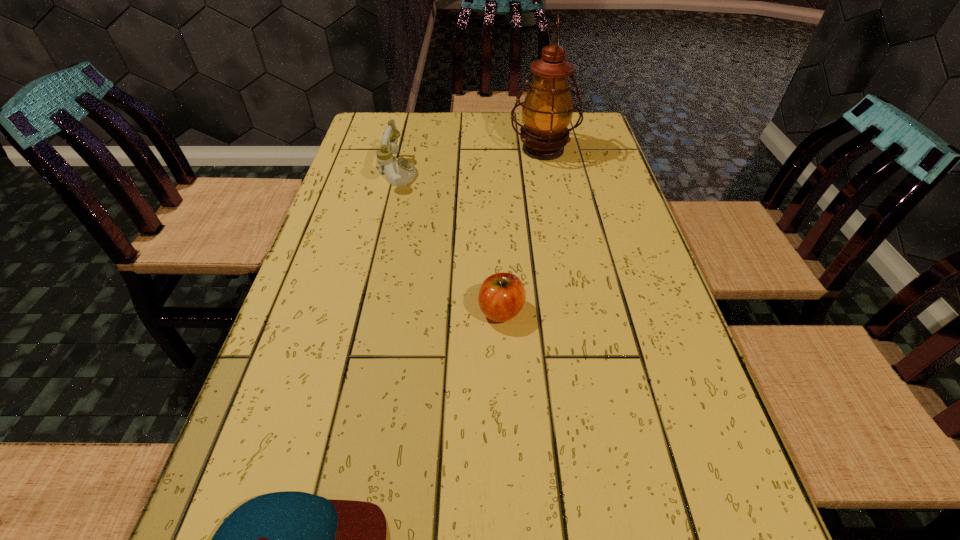
Identify which object is the closest to the baseball cap. Please provide its 2D coordinates. Your answer should be formatted as a tuple, i.e. [(x, y)], where the tuple contains the x and y coordinates of a point satisfying the conditions above.

[(501, 297)]

At what (x,y) coordinates should I click in order to perform the action: click on the second closest object to the telephone. Please return your answer as a coordinate pair (x, y). Looking at the image, I should click on (501, 297).

Image resolution: width=960 pixels, height=540 pixels. What are the coordinates of `vacant region that satisfies the following two spatial constraints: 1. on the dial of the apple; 2. on the left side of the second tallest object` in the screenshot? It's located at (365, 311).

I want to click on vacant position in the image that satisfies the following two spatial constraints: 1. on the back side of the apple; 2. on the dial of the telephone, so click(495, 173).

You are a GUI agent. You are given a task and a screenshot of the screen. Output one action in this format:
    pyautogui.click(x=<x>, y=<y>)
    Task: Click on the vacant space that satisfies the following two spatial constraints: 1. on the dial of the telephone; 2. on the left side of the apple
    The image size is (960, 540).
    Given the screenshot: What is the action you would take?
    pyautogui.click(x=365, y=311)

At what (x,y) coordinates should I click in order to perform the action: click on blank space that satisfies the following two spatial constraints: 1. on the front side of the tallest object; 2. on the dial of the telephone. Please return your answer as a coordinate pair (x, y). The height and width of the screenshot is (540, 960). Looking at the image, I should click on (547, 173).